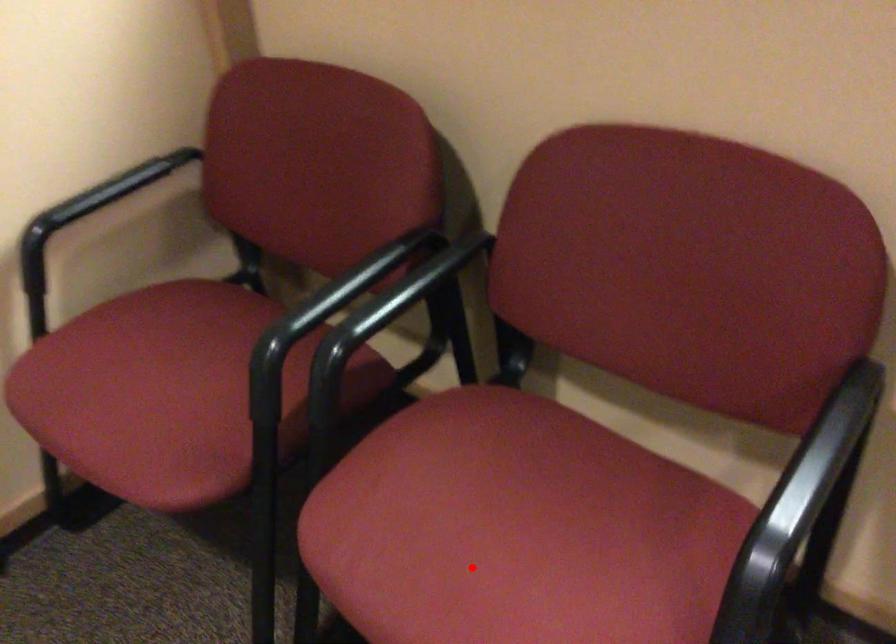
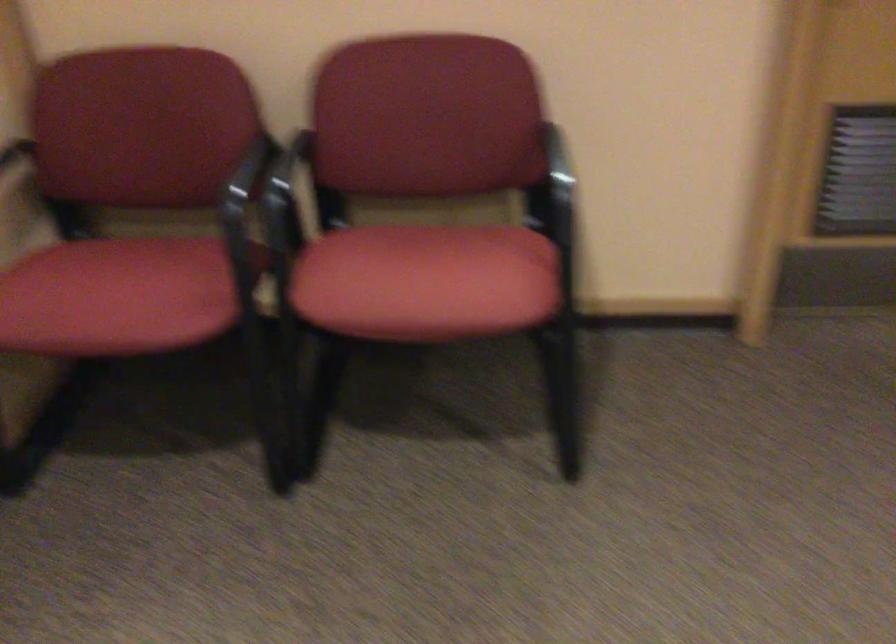
In the second image, find the point that corresponds to the highlighted location in the first image.

(426, 281)